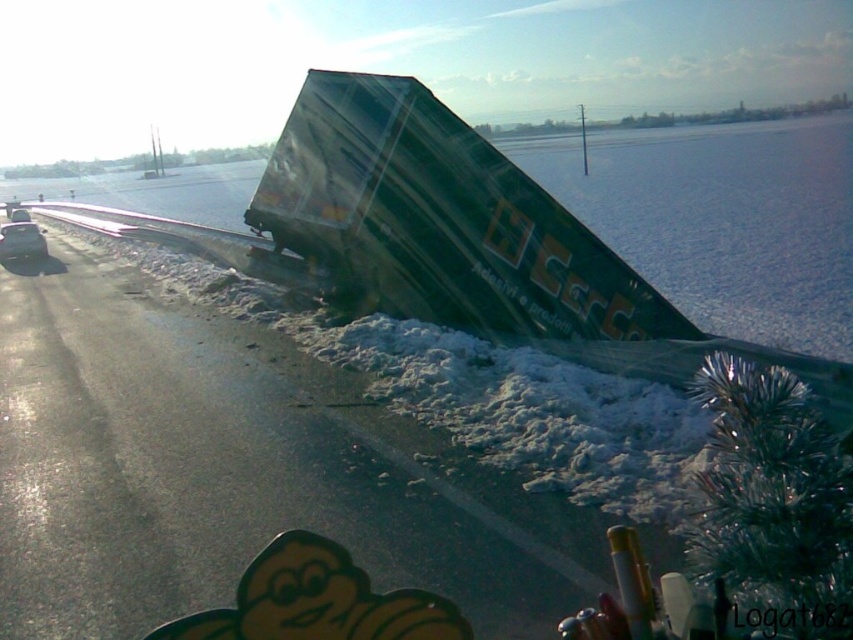
Can you confirm if green glossy trailer truck at center is positioned above shiny silver car at left?

Actually, green glossy trailer truck at center is below shiny silver car at left.

From the picture: Can you confirm if green glossy trailer truck at center is smaller than shiny silver car at left?

No.

Identify the location of green glossy trailer truck at center. (440, 220).

Locate an element on the screen. The height and width of the screenshot is (640, 853). green glossy trailer truck at center is located at coordinates (440, 220).

Can you confirm if green glossy trailer truck at center is bigger than metallic silver car at left?

Actually, green glossy trailer truck at center might be smaller than metallic silver car at left.

Which of these two, green glossy trailer truck at center or metallic silver car at left, stands taller?

Standing taller between the two is metallic silver car at left.

Which is in front, point (430, 120) or point (15, 221)?

Point (430, 120) is in front.

What are the coordinates of `green glossy trailer truck at center` in the screenshot? It's located at (440, 220).

Can you confirm if shiny silver car at left is shorter than metallic silver car at left?

Yes, shiny silver car at left is shorter than metallic silver car at left.

The height and width of the screenshot is (640, 853). What are the coordinates of `shiny silver car at left` in the screenshot? It's located at (21, 241).

The height and width of the screenshot is (640, 853). Find the location of `shiny silver car at left`. shiny silver car at left is located at coordinates (21, 241).